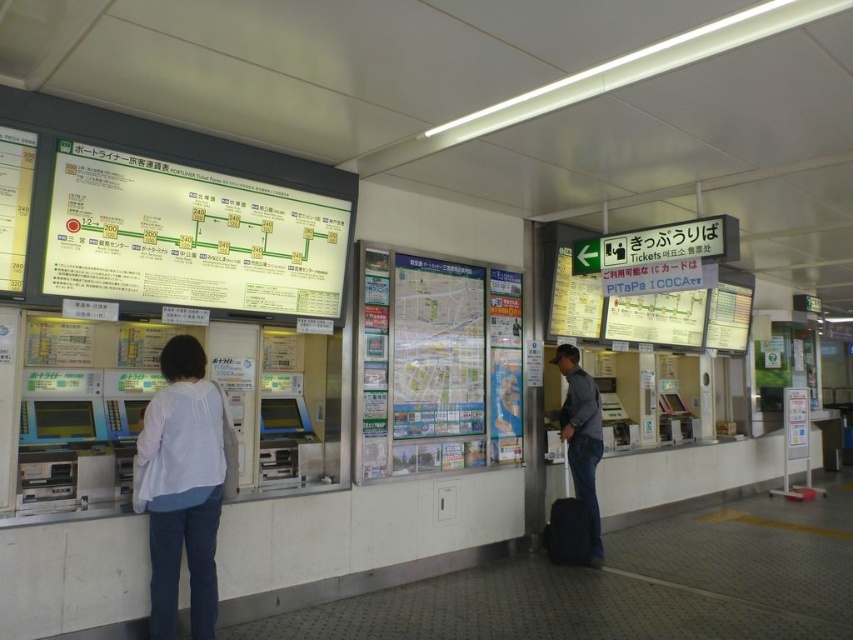
You are a traveler who just arrived at the station and need to check the departure time of your train. You see a white glossy signboard at upper left and a black fabric suitcase at lower right. Which object should you look at to find the departure time?

The white glossy signboard at upper left is much taller as black fabric suitcase at lower right. The departure time is likely displayed on the white glossy signboard at upper left since it is a larger screen and typically used for displaying important information like schedules.

You are a traveler who just arrived at the station and wants to read the information on the white glossy signboard at upper left and the white matte shirt at center. Which object is bigger so that you can read it more easily?

The white glossy signboard at upper left is larger in size than the white matte shirt at center, so you can read it more easily.

You are standing at the entrance of the ticketing counter area in the train station. You need to locate the white glossy signboard at upper left. According to the scene description, where should you look relative to your position?

The white glossy signboard at upper left is located at the upper left area of the scene, so you should look towards the upper left direction from your current position at the entrance.